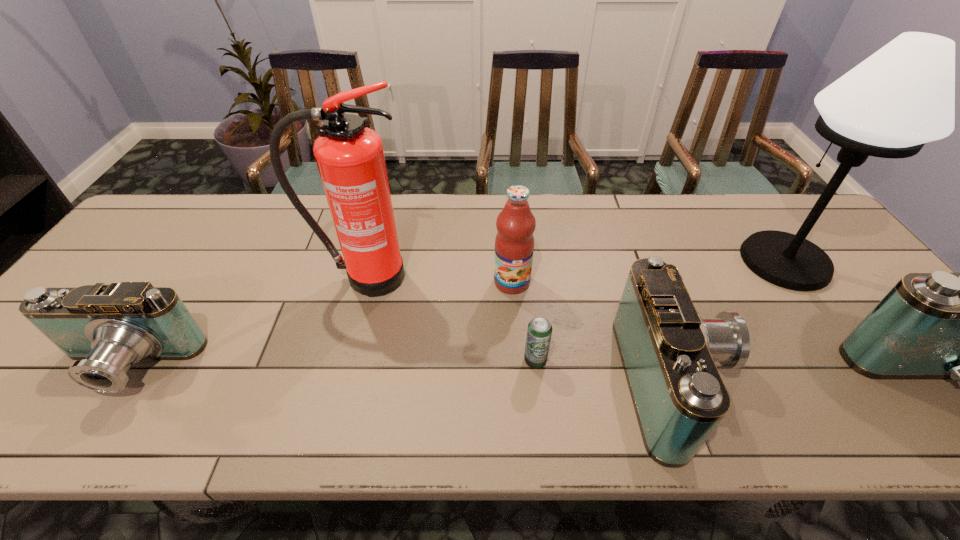
Where is `free spot located 0.150m on the front of the table lamp`? free spot located 0.150m on the front of the table lamp is located at coordinates point(841,341).

I want to click on blank space located 0.230m at the nozzle of the fire extinguisher, so click(339, 374).

You are a GUI agent. You are given a task and a screenshot of the screen. Output one action in this format:
    pyautogui.click(x=<x>, y=<y>)
    Task: Click on the vacant space located 0.200m on the back of the shortest object
    
    Given the screenshot: What is the action you would take?
    pyautogui.click(x=528, y=288)

Locate an element on the screen. This screenshot has width=960, height=540. object that is at the far edge is located at coordinates (903, 96).

Locate an element on the screen. beer can at the near edge is located at coordinates (539, 331).

At what (x,y) coordinates should I click in order to perform the action: click on object at the left edge. Please return your answer as a coordinate pair (x, y). This screenshot has width=960, height=540. Looking at the image, I should click on (107, 328).

Where is `object present at the right edge`? object present at the right edge is located at coordinates (903, 96).

The image size is (960, 540). Identify the location of object present at the near left corner. (107, 328).

Identify the location of object that is at the far right corner. (903, 96).

Where is `free point at the far edge`? free point at the far edge is located at coordinates (617, 235).